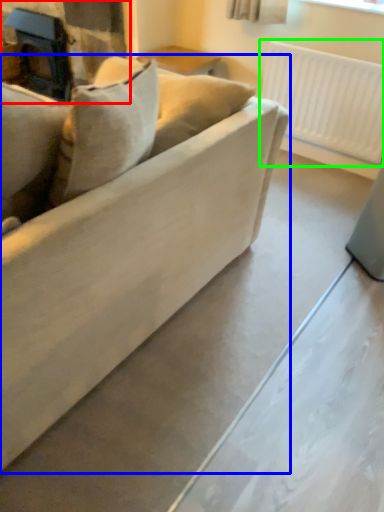
Question: Which is nearer to the fireplace (highlighted by a red box)? studio couch (highlighted by a blue box) or radiator (highlighted by a green box).

Choices:
 (A) studio couch
 (B) radiator

Answer: (B)